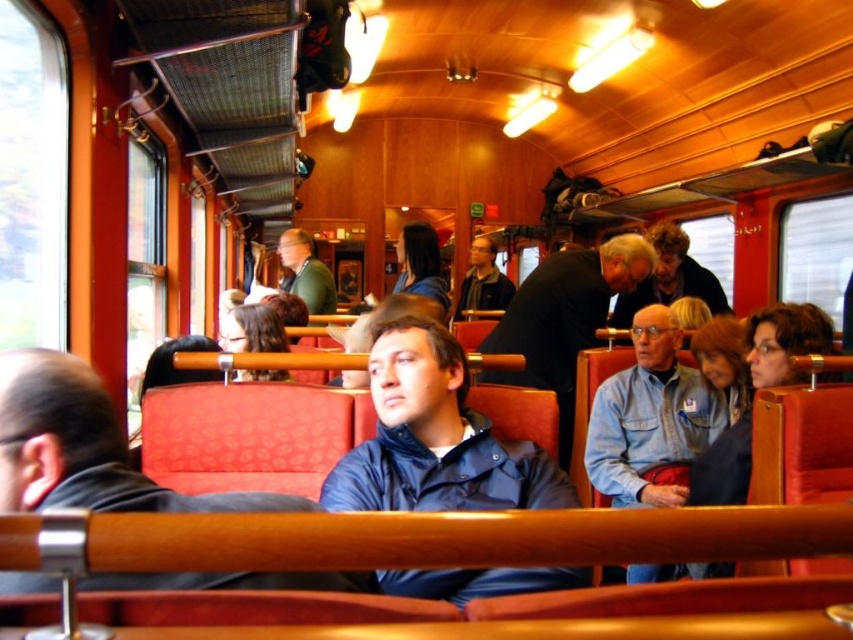
Question: Does blue matte jacket at center have a greater width compared to matte black jacket at center?

Choices:
 (A) no
 (B) yes

Answer: (B)

Question: Which point appears farthest from the camera in this image?

Choices:
 (A) (509, 300)
 (B) (306, 280)

Answer: (A)

Question: Which of the following is the closest to the observer?

Choices:
 (A) (503, 291)
 (B) (634, 246)

Answer: (B)

Question: In this image, where is black leather coat at center located relative to green fabric jacket at center?

Choices:
 (A) below
 (B) above

Answer: (A)

Question: Does black leather coat at center have a smaller size compared to matte black jacket at center?

Choices:
 (A) yes
 (B) no

Answer: (B)

Question: Which object appears farthest from the camera in this image?

Choices:
 (A) green fabric jacket at center
 (B) blue matte jacket at center

Answer: (A)